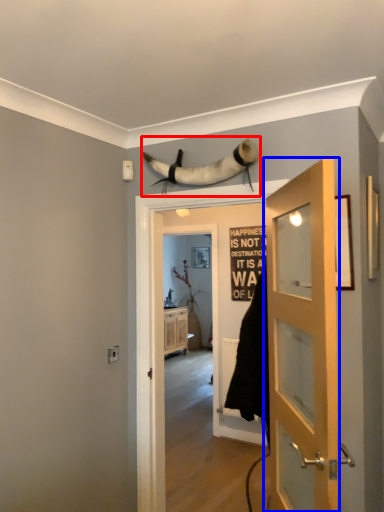
Question: Which of the following is the closest to the observer, animal (highlighted by a red box) or door (highlighted by a blue box)?

Choices:
 (A) animal
 (B) door

Answer: (B)